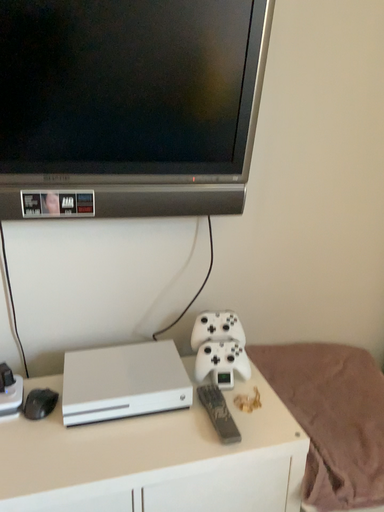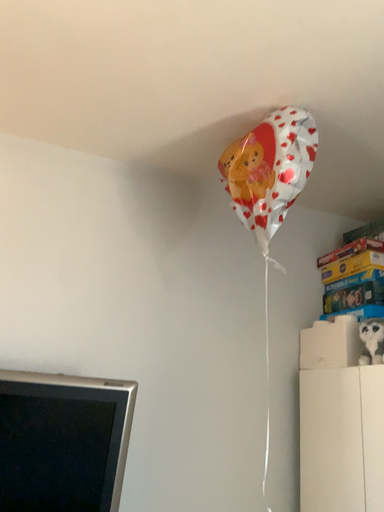
Question: How did the camera likely rotate when shooting the video?

Choices:
 (A) rotated upward
 (B) rotated downward

Answer: (A)